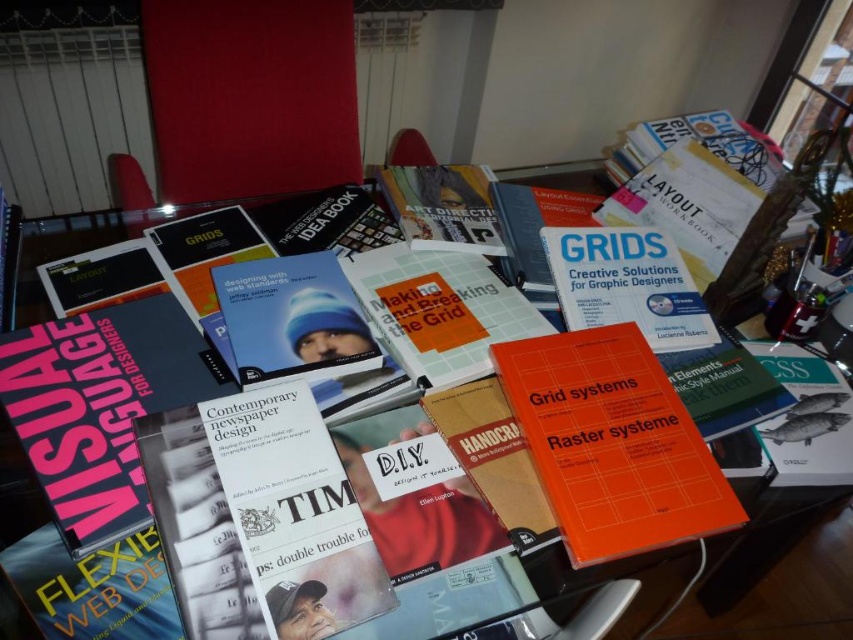
Question: Which of the following is the closest to the observer?

Choices:
 (A) transparent glass table at center
 (B) orange matte book at center

Answer: (B)

Question: Is orange matte book at center thinner than transparent glass table at center?

Choices:
 (A) no
 (B) yes

Answer: (B)

Question: Which object is closer to the camera taking this photo?

Choices:
 (A) transparent glass table at center
 (B) orange matte book at center

Answer: (B)

Question: Which of the following is the farthest from the observer?

Choices:
 (A) orange matte book at center
 (B) transparent glass table at center

Answer: (B)

Question: Does orange matte book at center come behind transparent glass table at center?

Choices:
 (A) no
 (B) yes

Answer: (A)

Question: Does orange matte book at center come behind transparent glass table at center?

Choices:
 (A) yes
 (B) no

Answer: (B)